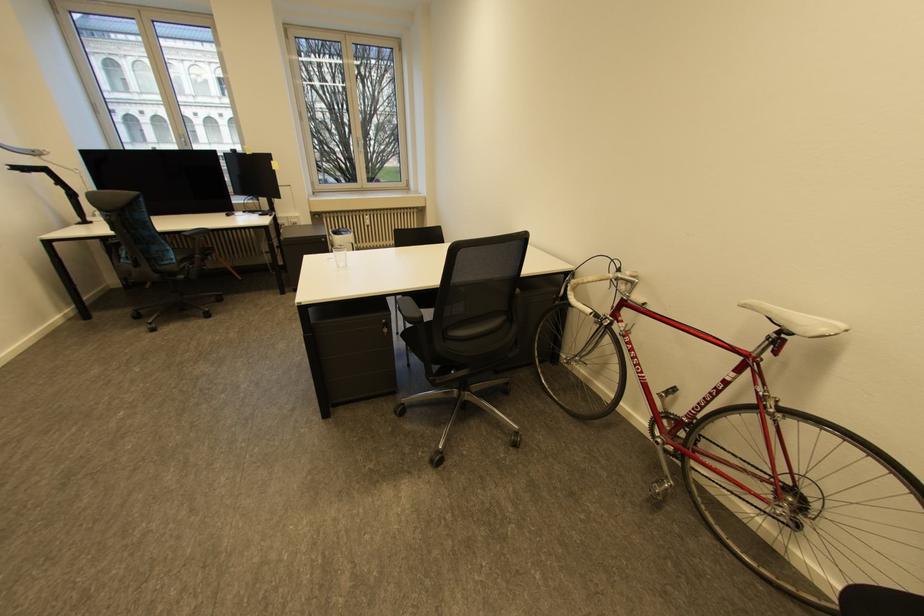
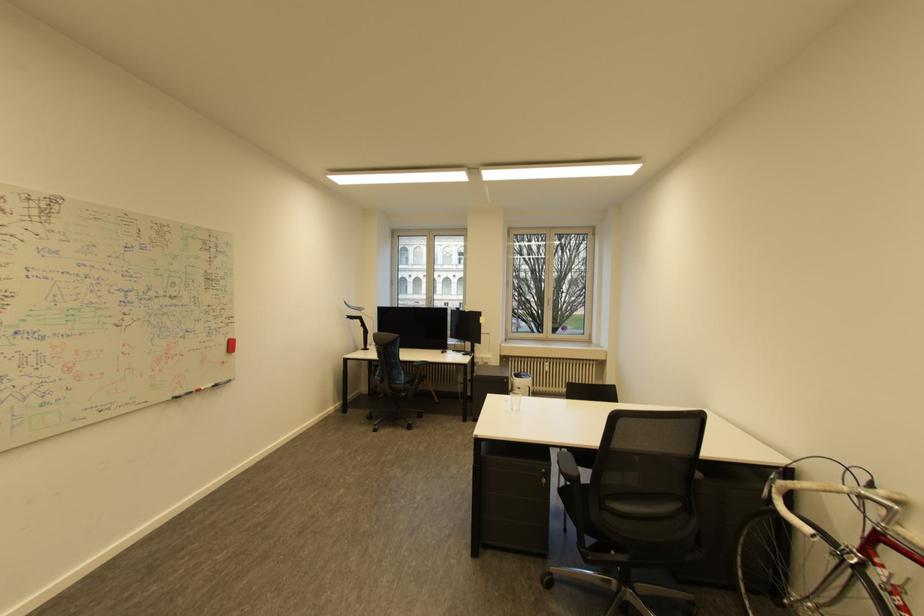
Locate, in the second image, the point that corresponds to point 429,317 in the first image.

(586, 477)